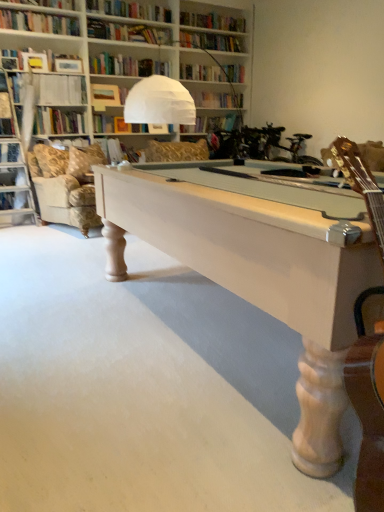
This screenshot has height=512, width=384. What do you see at coordinates (84, 162) in the screenshot? I see `beige fabric pillow at left` at bounding box center [84, 162].

Describe the element at coordinates (105, 96) in the screenshot. I see `matte brown book at upper center, positioned as the third book in bottom-to-top order` at that location.

You are a GUI agent. You are given a task and a screenshot of the screen. Output one action in this format:
    pyautogui.click(x=<x>, y=<y>)
    Task: Click on the shiny gold guitar at right
    The width and height of the screenshot is (384, 512).
    Given the screenshot: What is the action you would take?
    pyautogui.click(x=361, y=184)

From the image's perspective, is matte brown book at upper center, positioned as the third book in bottom-to-top order, located beneath white paper at upper left, the second book in the top-to-bottom sequence?

Incorrect, from the image's perspective, matte brown book at upper center, positioned as the third book in bottom-to-top order, is higher than white paper at upper left, the second book in the top-to-bottom sequence.

Can you confirm if matte brown book at upper center, which is counted as the first book, starting from the top, is taller than white paper at upper left, arranged as the second book when ordered from the bottom?

In fact, matte brown book at upper center, which is counted as the first book, starting from the top, may be shorter than white paper at upper left, arranged as the second book when ordered from the bottom.

Are matte brown book at upper center, positioned as the third book in bottom-to-top order, and white paper at upper left, the second book in the top-to-bottom sequence, far apart?

Actually, matte brown book at upper center, positioned as the third book in bottom-to-top order, and white paper at upper left, the second book in the top-to-bottom sequence, are a little close together.

Considering the sizes of objects velvet gold swivel chair at upper left and light beige fabric couch at left in the image provided, who is bigger, velvet gold swivel chair at upper left or light beige fabric couch at left?

light beige fabric couch at left is bigger.

Considering the positions of objects velvet gold swivel chair at upper left and light beige fabric couch at left in the image provided, who is in front, velvet gold swivel chair at upper left or light beige fabric couch at left?

light beige fabric couch at left is closer to the camera.

The height and width of the screenshot is (512, 384). In order to click on swivel chair lying above the light beige fabric couch at left (from the image's perspective) in this screenshot , I will do `click(66, 186)`.

Considering the sizes of objects velvet gold swivel chair at upper left and light beige fabric couch at left in the image provided, who is thinner, velvet gold swivel chair at upper left or light beige fabric couch at left?

velvet gold swivel chair at upper left is thinner.

Is white wood pool table at center wider or thinner than velvet gold swivel chair at upper left?

Clearly, white wood pool table at center has more width compared to velvet gold swivel chair at upper left.

Choose the correct answer: Is white wood pool table at center inside velvet gold swivel chair at upper left or outside it?

white wood pool table at center is not inside velvet gold swivel chair at upper left, it's outside.

Where is `swivel chair positioned vertically above the white wood pool table at center (from a real-world perspective)`? swivel chair positioned vertically above the white wood pool table at center (from a real-world perspective) is located at coordinates (66, 186).

Can you tell me how much white wood pool table at center and velvet gold swivel chair at upper left differ in facing direction?

The angle between the facing direction of white wood pool table at center and the facing direction of velvet gold swivel chair at upper left is 163 degrees.

From the image's perspective, does light beige fabric couch at left appear higher than white paper book at upper center, positioned as the 3th book in top-to-bottom order?

No, from the image's perspective, light beige fabric couch at left is not over white paper book at upper center, positioned as the 3th book in top-to-bottom order.

The image size is (384, 512). What are the coordinates of `couch below the white paper book at upper center, positioned as the 3th book in top-to-bottom order (from the image's perspective)` in the screenshot? It's located at (66, 185).

Considering the relative sizes of light beige fabric couch at left and white paper book at upper center, acting as the 1th book starting from the bottom, in the image provided, is light beige fabric couch at left taller than white paper book at upper center, acting as the 1th book starting from the bottom,?

Indeed, light beige fabric couch at left has a greater height compared to white paper book at upper center, acting as the 1th book starting from the bottom.

Consider the image. Who is smaller, light beige fabric couch at left or white paper book at upper center, acting as the 1th book starting from the bottom?

Smaller between the two is white paper book at upper center, acting as the 1th book starting from the bottom.

Is point (111, 155) less distant than point (74, 168)?

No, it is behind (74, 168).

Who is shorter, white paper book at upper center, acting as the 1th book starting from the bottom, or beige fabric pillow at left?

Standing shorter between the two is white paper book at upper center, acting as the 1th book starting from the bottom.

Where is `pillow below the white paper book at upper center, acting as the 1th book starting from the bottom (from a real-world perspective)`? This screenshot has height=512, width=384. pillow below the white paper book at upper center, acting as the 1th book starting from the bottom (from a real-world perspective) is located at coordinates (84, 162).

Is white paper book at upper center, acting as the 1th book starting from the bottom, not close to beige fabric pillow at left?

No, white paper book at upper center, acting as the 1th book starting from the bottom, is in close proximity to beige fabric pillow at left.

Is white wood pool table at center behind matte brown book at upper center, which is counted as the first book, starting from the top?

No, white wood pool table at center is in front of matte brown book at upper center, which is counted as the first book, starting from the top.

How much distance is there between white wood pool table at center and matte brown book at upper center, which is counted as the first book, starting from the top?

They are 3.79 meters apart.

Can you confirm if white wood pool table at center is shorter than matte brown book at upper center, positioned as the third book in bottom-to-top order?

Yes, white wood pool table at center is shorter than matte brown book at upper center, positioned as the third book in bottom-to-top order.

From a real-world perspective, is light beige fabric couch at left above or below white paper at upper left, arranged as the second book when ordered from the bottom?

From a real-world perspective, light beige fabric couch at left is physically below white paper at upper left, arranged as the second book when ordered from the bottom.

Is light beige fabric couch at left further to camera compared to white paper at upper left, arranged as the second book when ordered from the bottom?

No, it is not.

Is light beige fabric couch at left taller or shorter than white paper at upper left, arranged as the second book when ordered from the bottom?

Considering their sizes, light beige fabric couch at left has more height than white paper at upper left, arranged as the second book when ordered from the bottom.

Based on their positions, is light beige fabric couch at left located to the left or right of white paper at upper left, the second book in the top-to-bottom sequence?

From the image, it's evident that light beige fabric couch at left is to the right of white paper at upper left, the second book in the top-to-bottom sequence.

At what (x,y) coordinates should I click in order to perform the action: click on book on the left of matte brown book at upper center, which is counted as the first book, starting from the top. Please return your answer as a coordinate pair (x, y). Image resolution: width=384 pixels, height=512 pixels. Looking at the image, I should click on (x=62, y=90).

At what (x,y) coordinates should I click in order to perform the action: click on couch located underneath the velvet gold swivel chair at upper left (from a real-world perspective). Please return your answer as a coordinate pair (x, y). Looking at the image, I should click on (66, 185).

When comparing their distances from velvet gold swivel chair at upper left, does white paper book at upper center, acting as the 1th book starting from the bottom, or shiny gold guitar at right seem closer?

The object closer to velvet gold swivel chair at upper left is white paper book at upper center, acting as the 1th book starting from the bottom.

When comparing their distances from white paper at upper left, arranged as the second book when ordered from the bottom, does beige fabric pillow at left or light beige fabric couch at left seem further?

light beige fabric couch at left.

Which object lies further to the anchor point beige fabric pillow at left, matte brown book at upper center, which is counted as the first book, starting from the top, or white wood pool table at center?

Based on the image, white wood pool table at center appears to be further to beige fabric pillow at left.

Looking at this image, which object lies nearer to the anchor point white wood pool table at center, white paper book at upper center, positioned as the 3th book in top-to-bottom order, or white paper at upper left, arranged as the second book when ordered from the bottom?

Based on the image, white paper book at upper center, positioned as the 3th book in top-to-bottom order, appears to be nearer to white wood pool table at center.

When comparing their distances from shiny gold guitar at right, does white paper at upper left, arranged as the second book when ordered from the bottom, or velvet gold swivel chair at upper left seem closer?

The object closer to shiny gold guitar at right is velvet gold swivel chair at upper left.

Which object lies nearer to the anchor point shiny gold guitar at right, beige fabric pillow at left or white paper book at upper center, acting as the 1th book starting from the bottom?

Based on the image, beige fabric pillow at left appears to be nearer to shiny gold guitar at right.

From the image, which object appears to be nearer to white paper book at upper center, acting as the 1th book starting from the bottom, shiny gold guitar at right or velvet gold swivel chair at upper left?

velvet gold swivel chair at upper left is closer to white paper book at upper center, acting as the 1th book starting from the bottom.

From the image, which object appears to be nearer to shiny gold guitar at right, white paper at upper left, the second book in the top-to-bottom sequence, or light beige fabric couch at left?

light beige fabric couch at left lies closer to shiny gold guitar at right than the other object.

The image size is (384, 512). I want to click on pillow between light beige fabric couch at left and shiny gold guitar at right, so click(x=84, y=162).

I want to click on pillow between white wood pool table at center and matte brown book at upper center, which is counted as the first book, starting from the top, in the front-back direction, so click(84, 162).

Where is `couch positioned between white wood pool table at center and white paper book at upper center, acting as the 1th book starting from the bottom, from near to far`? Image resolution: width=384 pixels, height=512 pixels. couch positioned between white wood pool table at center and white paper book at upper center, acting as the 1th book starting from the bottom, from near to far is located at coordinates (66, 185).

You are a GUI agent. You are given a task and a screenshot of the screen. Output one action in this format:
    pyautogui.click(x=<x>, y=<y>)
    Task: Click on the couch located between white wood pool table at center and beige fabric pillow at left in the depth direction
    The width and height of the screenshot is (384, 512).
    Given the screenshot: What is the action you would take?
    pyautogui.click(x=66, y=185)